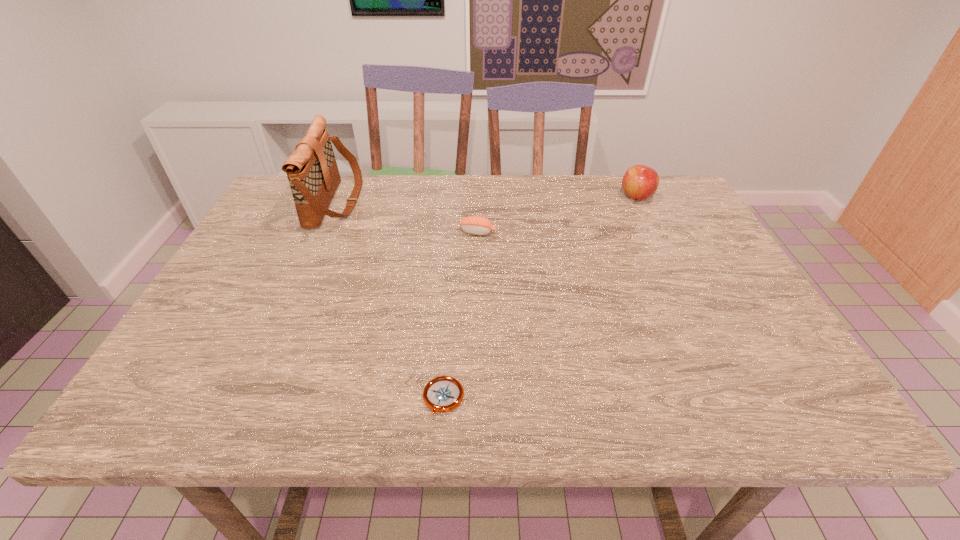
In order to click on free space that satisfies the following two spatial constraints: 1. on the front-facing side of the shoulder bag; 2. on the right side of the sushi in this screenshot , I will do `click(323, 232)`.

Locate an element on the screen. vacant position in the image that satisfies the following two spatial constraints: 1. on the front-facing side of the tallest object; 2. on the back side of the compass is located at coordinates pos(249,399).

Identify the location of vacant area that satisfies the following two spatial constraints: 1. on the front-facing side of the tallest object; 2. on the back side of the third tallest object. (323, 232).

Where is `free spot that satisfies the following two spatial constraints: 1. on the back side of the second shortest object; 2. on the left side of the compass`? free spot that satisfies the following two spatial constraints: 1. on the back side of the second shortest object; 2. on the left side of the compass is located at coordinates (455, 232).

This screenshot has width=960, height=540. Find the location of `free location that satisfies the following two spatial constraints: 1. on the front-facing side of the shoulder bag; 2. on the right side of the sushi`. free location that satisfies the following two spatial constraints: 1. on the front-facing side of the shoulder bag; 2. on the right side of the sushi is located at coordinates (323, 232).

In order to click on vacant region that satisfies the following two spatial constraints: 1. on the front-facing side of the compass; 2. on the right side of the shoulder bag in this screenshot , I will do `click(249, 399)`.